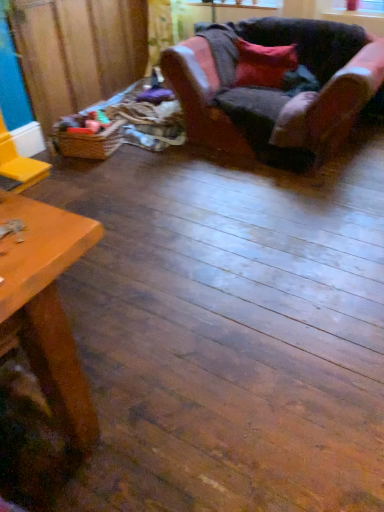
Locate an element on the screen. free space above woven brown basket at left (from a real-world perspective) is located at coordinates (91, 124).